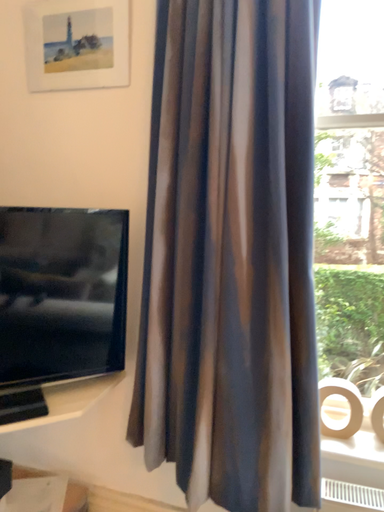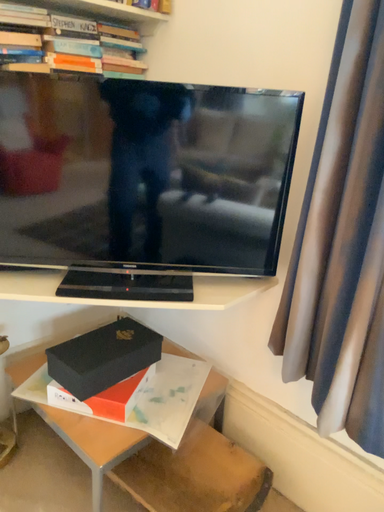
Question: Which way did the camera rotate in the video?

Choices:
 (A) rotated upward
 (B) rotated downward

Answer: (B)